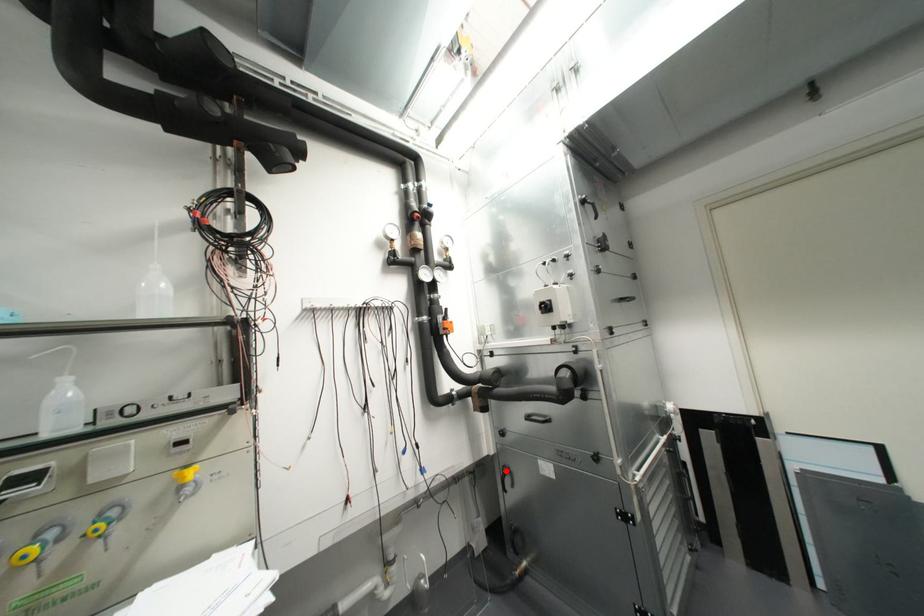
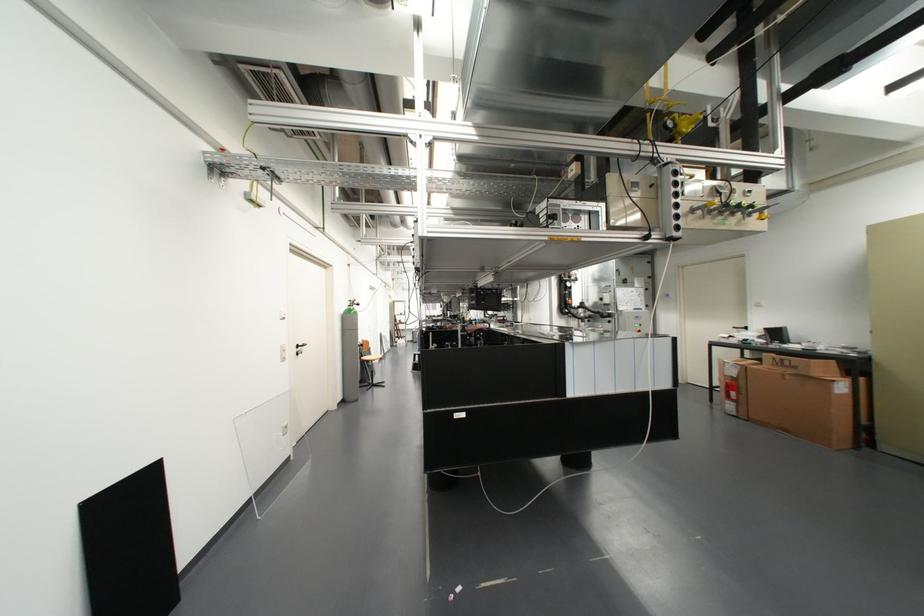
Question: I am providing you with two images of the same scene from different viewpoints. A red point is marked on the first image. Is the red point's position out of view in image 2?

Choices:
 (A) Yes
 (B) No

Answer: (A)